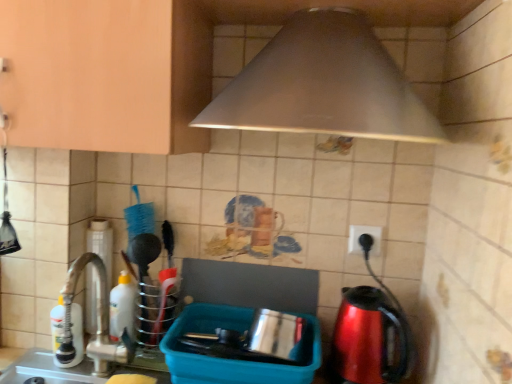
Question: Choose the correct answer: Is metallic stainless steel pot at center, the 1th appliance viewed from the right, inside brushed metal faucet at left, marked as the 1th appliance in a left-to-right arrangement, or outside it?

Choices:
 (A) outside
 (B) inside

Answer: (A)

Question: Considering the positions of metallic stainless steel pot at center, the 1th appliance viewed from the right, and brushed metal faucet at left, which ranks as the second appliance in right-to-left order, in the image, is metallic stainless steel pot at center, the 1th appliance viewed from the right, wider or thinner than brushed metal faucet at left, which ranks as the second appliance in right-to-left order,?

Choices:
 (A) wide
 (B) thin

Answer: (A)

Question: Which is nearer to the metallic stainless steel pot at center, positioned as the 2th appliance in left-to-right order?

Choices:
 (A) shiny metallic kettle at right
 (B) white glossy bottle at left, acting as the second bottle starting from the right
 (C) white plastic electric outlet at upper right
 (D) satin nickel faucet at left
 (E) white plastic bottle at left, the second bottle in the left-to-right sequence

Answer: (D)

Question: Considering the real-world distances, which object is farthest from the white glossy bottle at left, marked as the 1th bottle in a front-to-back arrangement?

Choices:
 (A) shiny metallic kettle at right
 (B) metallic silver hood at upper center
 (C) satin nickel faucet at left
 (D) brushed metal faucet at left, marked as the 1th appliance in a left-to-right arrangement
 (E) white plastic bottle at left, the 2th bottle from the front

Answer: (B)